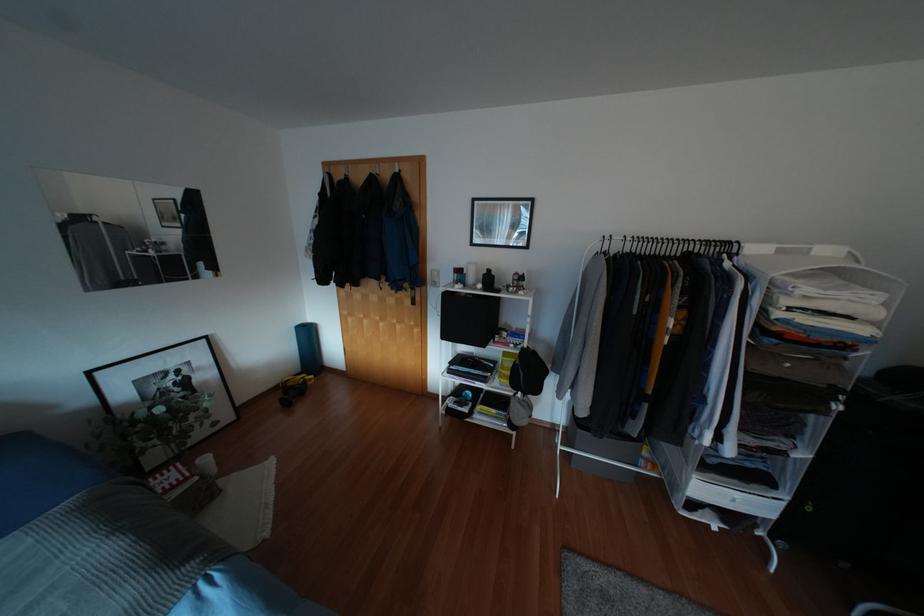
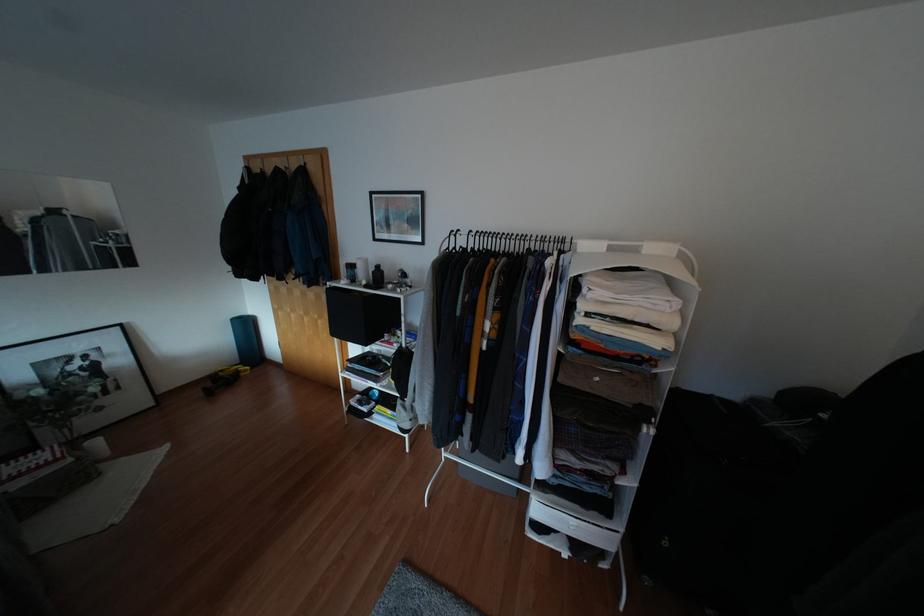
In the second image, find the point that corresponds to (x=479, y=285) in the first image.

(362, 282)